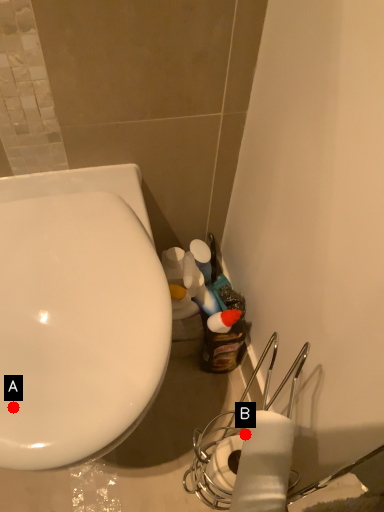
Question: Two points are circled on the image, labeled by A and B beside each circle. Which point appears closest to the camera in this image?

Choices:
 (A) A is closer
 (B) B is closer

Answer: (A)